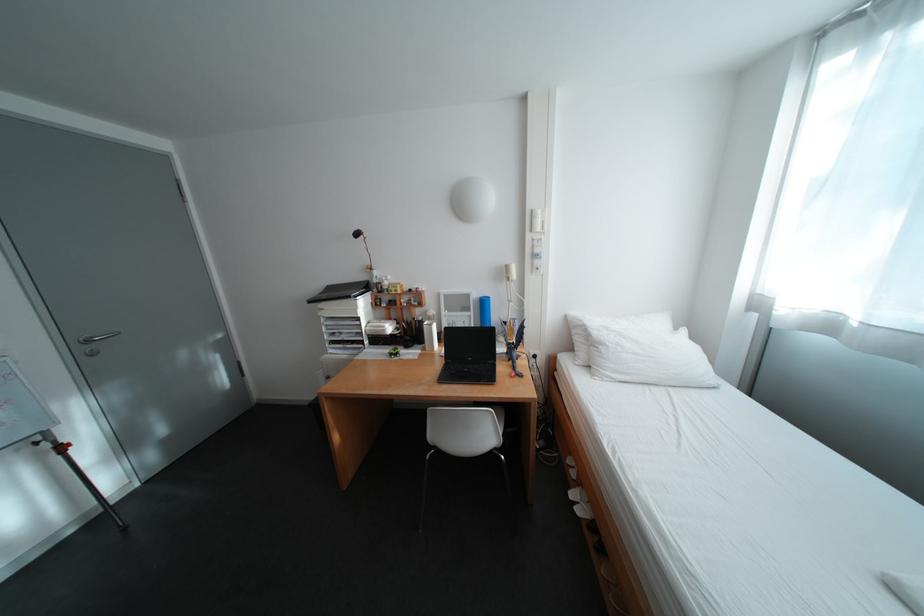
The width and height of the screenshot is (924, 616). What do you see at coordinates (342, 328) in the screenshot?
I see `the white paper tray` at bounding box center [342, 328].